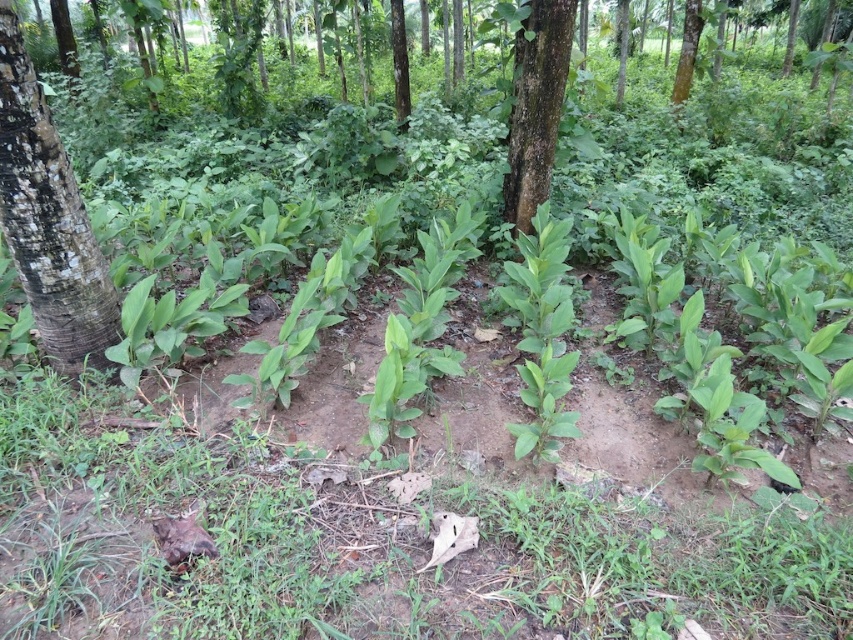
You are a hiker who wants to take a close look at the rough bark tree trunk at left. If your arms are 0.7 meters long, can you reach the tree trunk without moving closer?

The rough bark tree trunk at left is 2.18 meters away from the camera. Since your arms are only 0.7 meters long, you cannot reach the tree trunk without moving closer.

You are a hiker who wants to identify two specific tree trunks in the forest. You see the rough bark tree trunk at center and the smooth brown tree trunk at upper right. Which of these two tree trunks is positioned more to the left side of the image?

The rough bark tree trunk at center is positioned more to the left side of the image compared to the smooth brown tree trunk at upper right.

Looking at this image, you are standing in the forest and want to locate the rough bark tree trunk at left. According to the coordinates provided, where should you look?

The rough bark tree trunk at left is located at point (48, 220).